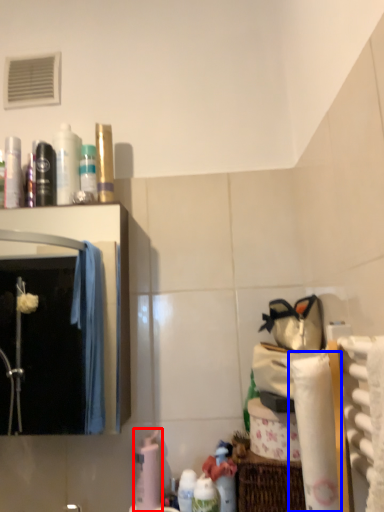
Question: Among these objects, which one is farthest to the camera, cleaning product (highlighted by a red box) or toilet paper (highlighted by a blue box)?

Choices:
 (A) cleaning product
 (B) toilet paper

Answer: (A)